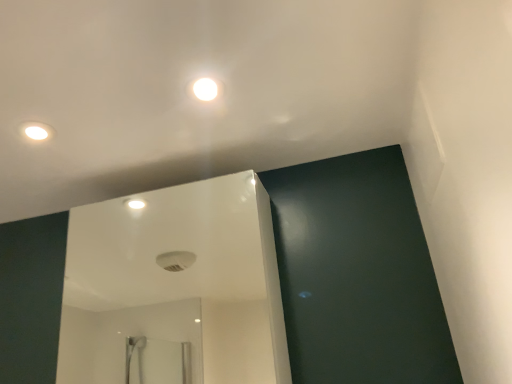
What is the approximate height of white glossy mirror at center?

20.06 inches.

What do you see at coordinates (174, 287) in the screenshot?
I see `white glossy mirror at center` at bounding box center [174, 287].

The width and height of the screenshot is (512, 384). I want to click on white glossy mirror at center, so click(174, 287).

Identify the location of white glossy mirror at center. This screenshot has width=512, height=384. (174, 287).